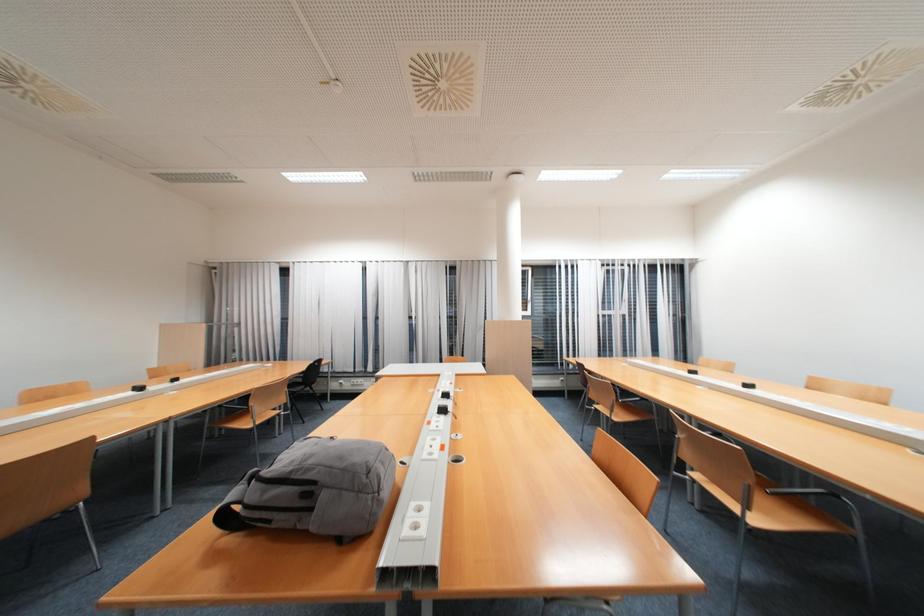
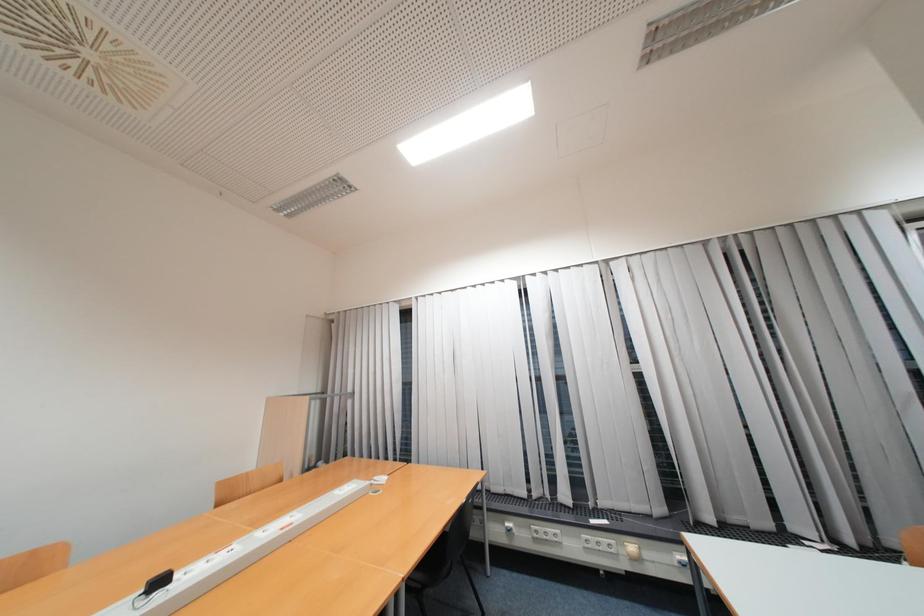
Which direction would the cameraman need to move to produce the second image?

The cameraman walked toward left, forward.